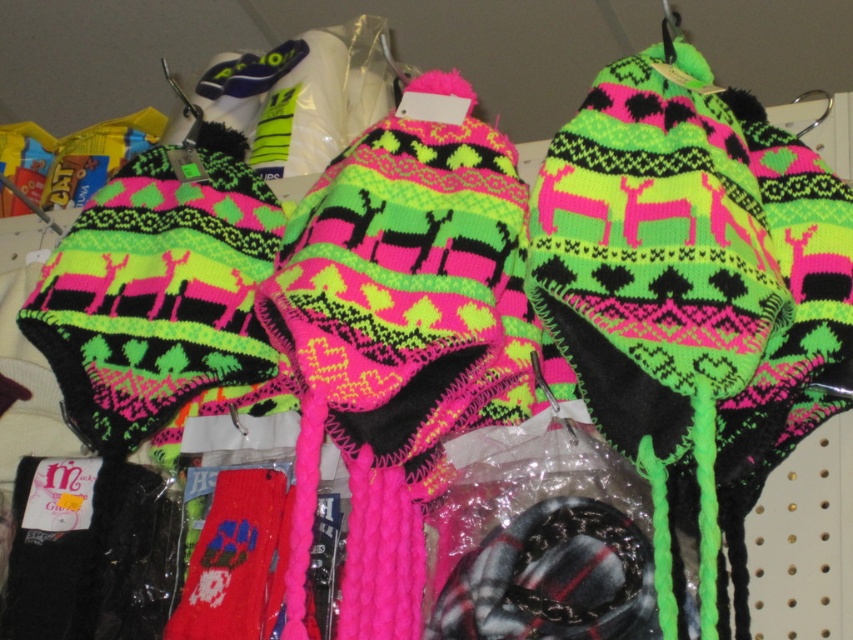
Does neon pink knitted sock at center come in front of knitted wool socks at center?

Yes, neon pink knitted sock at center is in front of knitted wool socks at center.

Can you confirm if neon pink knitted sock at center is positioned above knitted wool socks at center?

Yes.

Which is in front, point (399, 531) or point (231, 547)?

Positioned in front is point (399, 531).

Where is `neon pink knitted sock at center`? This screenshot has width=853, height=640. neon pink knitted sock at center is located at coordinates (399, 333).